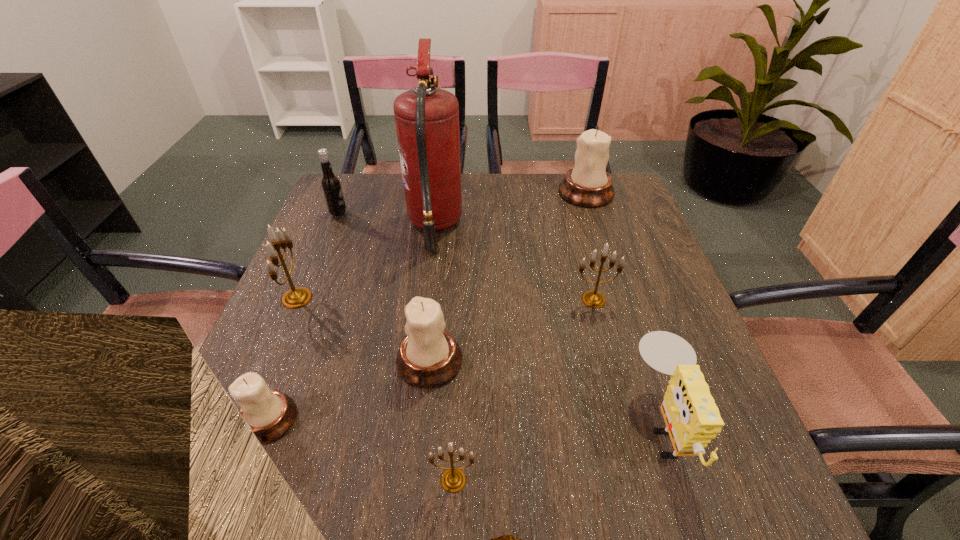
Locate an element on the screen. The image size is (960, 540). vacant space that's between the fire extinguisher and the biggest white candle holder is located at coordinates (511, 209).

You are a GUI agent. You are given a task and a screenshot of the screen. Output one action in this format:
    pyautogui.click(x=<x>, y=<y>)
    Task: Click on the vacant space in between the smallest gold candelabrum and the biggest gold candelabrum
    The image size is (960, 540).
    Given the screenshot: What is the action you would take?
    pyautogui.click(x=375, y=389)

Find the location of `unoccupied position between the biggest gold candelabrum and the leftmost white candle holder`. unoccupied position between the biggest gold candelabrum and the leftmost white candle holder is located at coordinates (282, 359).

Find the location of `vacant space that is in between the sponge and the smallest white candle holder`. vacant space that is in between the sponge and the smallest white candle holder is located at coordinates (466, 422).

In order to click on free point between the second white candle holder from left to right and the second biggest gold candelabrum in this screenshot , I will do `click(512, 330)`.

Find the location of a particular element. The height and width of the screenshot is (540, 960). empty location between the biggest gold candelabrum and the second biggest gold candelabrum is located at coordinates (445, 299).

This screenshot has width=960, height=540. What are the coordinates of `free space between the leftmost gold candelabrum and the rightmost white candle holder` in the screenshot? It's located at click(x=442, y=245).

Locate an element on the screen. free space between the yellow sponge and the second nearest candelabrum is located at coordinates (466, 422).

The image size is (960, 540). What are the coordinates of `vacant space in between the second white candle holder from right to left and the fifth farthest candelabrum` in the screenshot? It's located at (349, 390).

Where is `object identified as the closest to the biggest gold candelabrum`? The width and height of the screenshot is (960, 540). object identified as the closest to the biggest gold candelabrum is located at coordinates pyautogui.click(x=270, y=414).